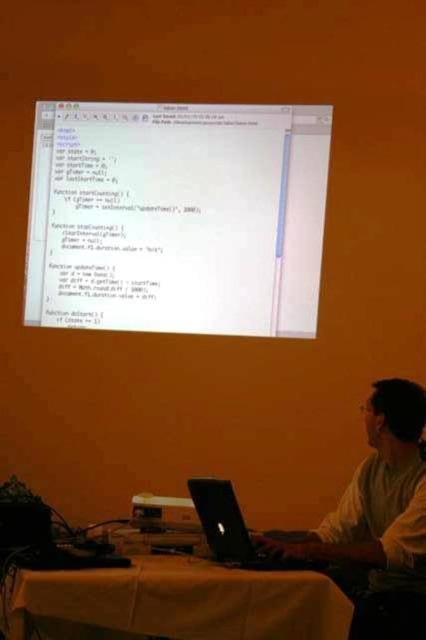
Looking at this image, can you confirm if white shirt at center is positioned to the right of black matte laptop at center?

Yes, white shirt at center is to the right of black matte laptop at center.

Who is positioned more to the left, white shirt at center or black matte laptop at center?

black matte laptop at center

Between point (396, 621) and point (239, 552), which one is positioned in front?

Positioned in front is point (239, 552).

This screenshot has width=426, height=640. What are the coordinates of `white shirt at center` in the screenshot? It's located at (379, 518).

Measure the distance between white glossy text at center and camera.

white glossy text at center and camera are 16.57 feet apart.

Who is positioned more to the right, white glossy text at center or yellow fabric table at lower center?

From the viewer's perspective, yellow fabric table at lower center appears more on the right side.

Does point (114, 125) come in front of point (209, 602)?

No, (114, 125) is behind (209, 602).

This screenshot has width=426, height=640. In order to click on white glossy text at center in this screenshot , I will do (x=176, y=218).

Locate an element on the screen. white glossy text at center is located at coordinates (176, 218).

Is white glossy text at center positioned at the back of matte black projector at center?

Yes, it is behind matte black projector at center.

This screenshot has height=640, width=426. Find the location of `white glossy text at center`. white glossy text at center is located at coordinates [x=176, y=218].

Find the location of a particular element. This screenshot has width=426, height=640. white glossy text at center is located at coordinates (176, 218).